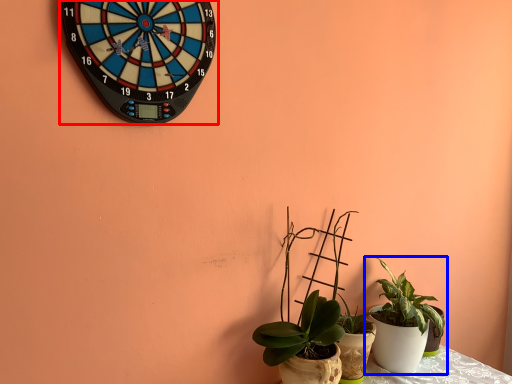
Question: Which of the following is the closest to the observer, wall clock (highlighted by a red box) or houseplant (highlighted by a blue box)?

Choices:
 (A) wall clock
 (B) houseplant

Answer: (A)